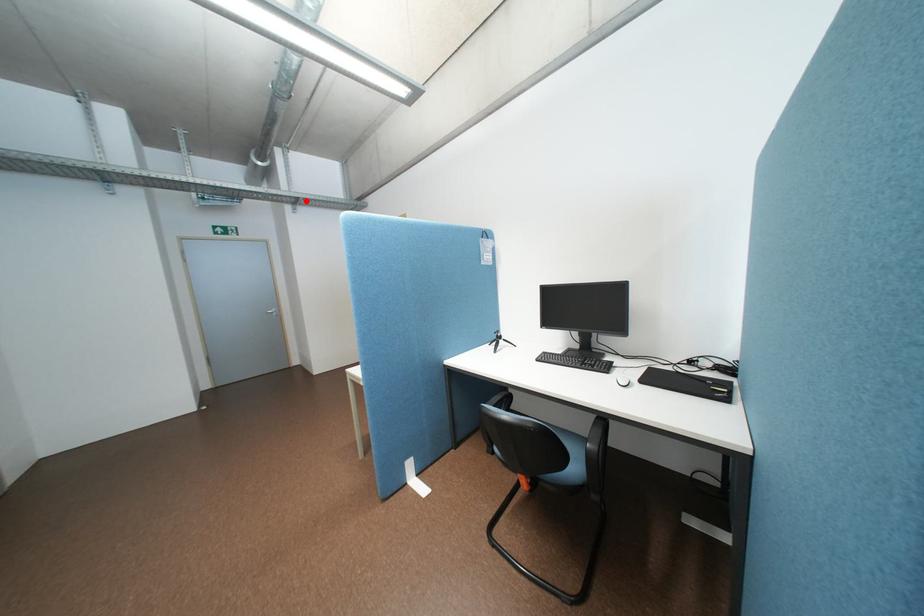
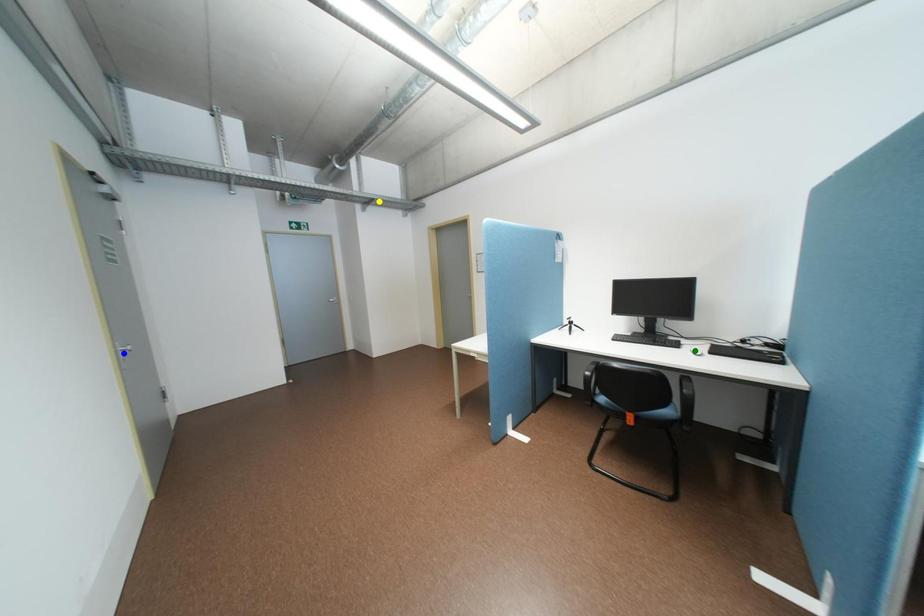
Question: I am providing you with two images of the same scene from different viewpoints. A red point is marked on the first image. You are given multiple points on the second image. Which point in image 2 represents the same 3d spot as the red point in image 1?

Choices:
 (A) green point
 (B) yellow point
 (C) blue point

Answer: (B)